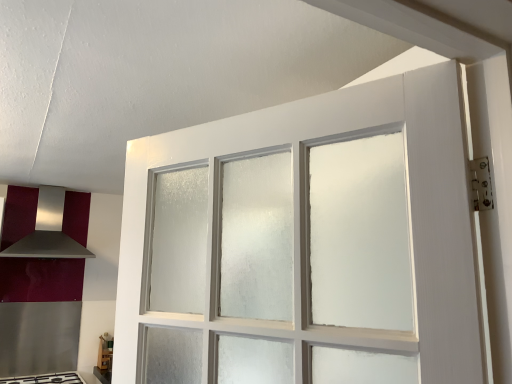
The height and width of the screenshot is (384, 512). In order to click on white glossy gas stove at lower left in this screenshot , I will do `click(46, 379)`.

Describe the element at coordinates (46, 379) in the screenshot. I see `white glossy gas stove at lower left` at that location.

Where is `satin silver exhaust hood at left`? satin silver exhaust hood at left is located at coordinates (48, 231).

Image resolution: width=512 pixels, height=384 pixels. Describe the element at coordinates (48, 231) in the screenshot. I see `satin silver exhaust hood at left` at that location.

You are a GUI agent. You are given a task and a screenshot of the screen. Output one action in this format:
    pyautogui.click(x=<x>, y=<y>)
    Task: Click on the white glossy gas stove at lower left
    
    Given the screenshot: What is the action you would take?
    pyautogui.click(x=46, y=379)

Is white glossy gas stove at lower left to the left or to the right of satin silver exhaust hood at left in the image?

white glossy gas stove at lower left is positioned on satin silver exhaust hood at left's right side.

Which object is more forward, white glossy gas stove at lower left or satin silver exhaust hood at left?

white glossy gas stove at lower left is closer to the camera.

Is point (72, 381) less distant than point (83, 254)?

Yes, point (72, 381) is in front of point (83, 254).

From the image's perspective, relative to satin silver exhaust hood at left, is white glossy gas stove at lower left above or below?

Clearly, from the image's perspective, white glossy gas stove at lower left is below satin silver exhaust hood at left.

From a real-world perspective, between white glossy gas stove at lower left and satin silver exhaust hood at left, who is vertically higher?

In real-world perspective, satin silver exhaust hood at left is above.

Looking at their sizes, would you say white glossy gas stove at lower left is wider or thinner than satin silver exhaust hood at left?

In the image, white glossy gas stove at lower left appears to be wider than satin silver exhaust hood at left.

In the scene shown: Who is shorter, white glossy gas stove at lower left or satin silver exhaust hood at left?

Standing shorter between the two is white glossy gas stove at lower left.

Is white glossy gas stove at lower left smaller than satin silver exhaust hood at left?

Yes.

Is white glossy gas stove at lower left not within satin silver exhaust hood at left?

Yes, white glossy gas stove at lower left is not within satin silver exhaust hood at left.

Does white glossy gas stove at lower left touch satin silver exhaust hood at left?

No, white glossy gas stove at lower left is not in contact with satin silver exhaust hood at left.

Is satin silver exhaust hood at left at the back of white glossy gas stove at lower left?

No, white glossy gas stove at lower left is not facing the opposite direction of satin silver exhaust hood at left.

Can you tell me how much white glossy gas stove at lower left and satin silver exhaust hood at left differ in facing direction?

The angular difference between white glossy gas stove at lower left and satin silver exhaust hood at left is 1.49 degrees.

Find the location of `gas stove lying below the satin silver exhaust hood at left (from the image's perspective)`. gas stove lying below the satin silver exhaust hood at left (from the image's perspective) is located at coordinates (46, 379).

Is satin silver exhaust hood at left to the left or to the right of white glossy gas stove at lower left in the image?

In the image, satin silver exhaust hood at left appears on the left side of white glossy gas stove at lower left.

Which is behind, satin silver exhaust hood at left or white glossy gas stove at lower left?

satin silver exhaust hood at left is further away from the camera.

Which point is more distant from viewer, (56, 257) or (33, 375)?

Positioned behind is point (56, 257).

From the image's perspective, who appears lower, satin silver exhaust hood at left or white glossy gas stove at lower left?

white glossy gas stove at lower left is shown below in the image.

From a real-world perspective, is satin silver exhaust hood at left positioned under white glossy gas stove at lower left based on gravity?

No, from a real-world perspective, satin silver exhaust hood at left is not under white glossy gas stove at lower left.

Which object is thinner, satin silver exhaust hood at left or white glossy gas stove at lower left?

satin silver exhaust hood at left is thinner.

From their relative heights in the image, would you say satin silver exhaust hood at left is taller or shorter than white glossy gas stove at lower left?

Clearly, satin silver exhaust hood at left is taller compared to white glossy gas stove at lower left.

Is satin silver exhaust hood at left bigger or smaller than white glossy gas stove at lower left?

Considering their sizes, satin silver exhaust hood at left takes up more space than white glossy gas stove at lower left.

Is satin silver exhaust hood at left located outside white glossy gas stove at lower left?

Yes, satin silver exhaust hood at left is located beyond the bounds of white glossy gas stove at lower left.

Are satin silver exhaust hood at left and white glossy gas stove at lower left making contact?

No, satin silver exhaust hood at left is not with white glossy gas stove at lower left.

Could you tell me if satin silver exhaust hood at left is facing white glossy gas stove at lower left?

No, satin silver exhaust hood at left does not turn towards white glossy gas stove at lower left.

This screenshot has width=512, height=384. Find the location of `gas stove in front of the satin silver exhaust hood at left`. gas stove in front of the satin silver exhaust hood at left is located at coordinates (46, 379).

I want to click on gas stove located underneath the satin silver exhaust hood at left (from a real-world perspective), so coord(46,379).

This screenshot has width=512, height=384. Identify the location of exhaust hood on the left of white glossy gas stove at lower left. (48, 231).